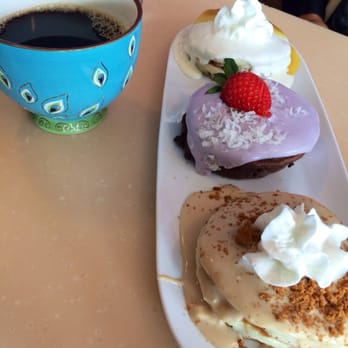
Identify the location of blue coffee cup. This screenshot has height=348, width=348. (68, 78).